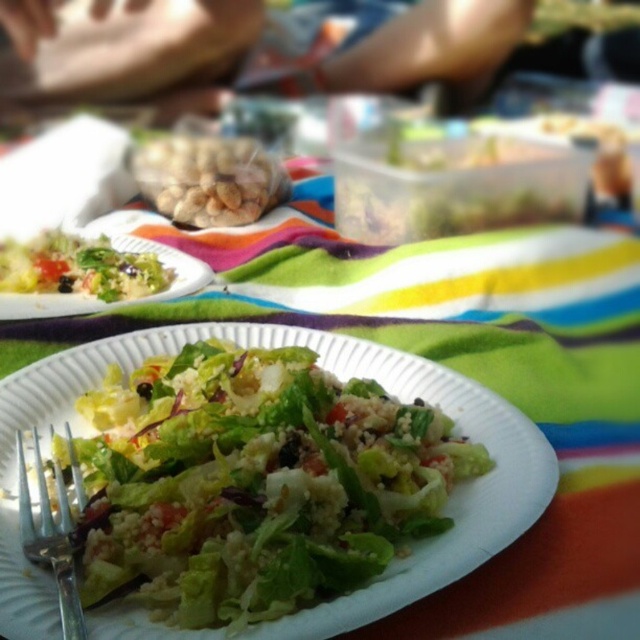
From the picture: You are a guest at this picnic and want to choose the tallest salad between the green leafy salad at center and the green leafy salad at left. Which one should you pick?

The green leafy salad at center is much taller than the green leafy salad at left, so you should pick the green leafy salad at center.

You are planning to serve more guests and need to choose between the green leafy salad at center and the green leafy salad at left. Which salad should you pick to serve more people?

The green leafy salad at center is larger in size than the green leafy salad at left, so you should pick the green leafy salad at center to serve more people.